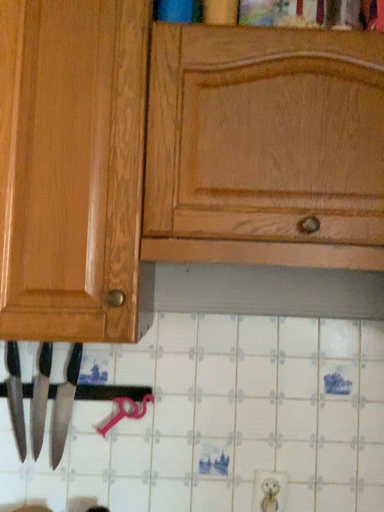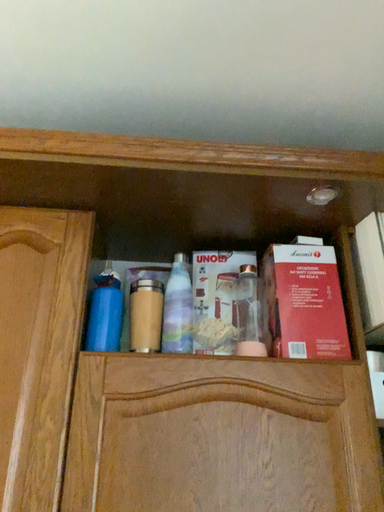
Question: How did the camera likely rotate when shooting the video?

Choices:
 (A) rotated downward
 (B) rotated upward

Answer: (B)